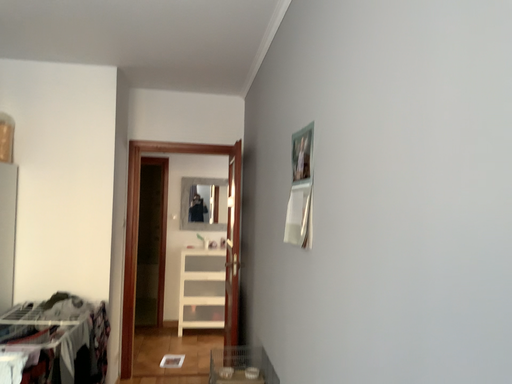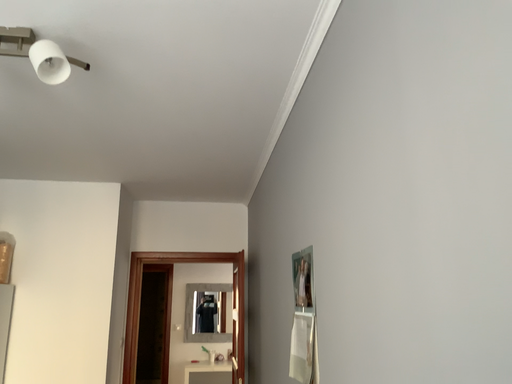
Question: Which way did the camera rotate in the video?

Choices:
 (A) rotated upward
 (B) rotated downward

Answer: (A)